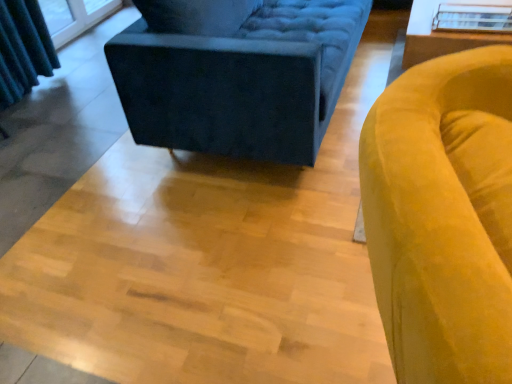
Question: Considering the relative positions of velvet yellow armchair at right and velvet dark blue studio couch at upper center in the image provided, is velvet yellow armchair at right behind velvet dark blue studio couch at upper center?

Choices:
 (A) yes
 (B) no

Answer: (B)

Question: Is velvet yellow armchair at right not inside velvet dark blue studio couch at upper center?

Choices:
 (A) yes
 (B) no

Answer: (A)

Question: From a real-world perspective, is velvet yellow armchair at right below velvet dark blue studio couch at upper center?

Choices:
 (A) no
 (B) yes

Answer: (A)

Question: Is velvet yellow armchair at right oriented towards velvet dark blue studio couch at upper center?

Choices:
 (A) yes
 (B) no

Answer: (B)

Question: Is velvet yellow armchair at right taller than velvet dark blue studio couch at upper center?

Choices:
 (A) no
 (B) yes

Answer: (B)

Question: From a real-world perspective, is transparent glass table at upper right above or below velvet dark blue studio couch at upper center?

Choices:
 (A) above
 (B) below

Answer: (A)

Question: Is transparent glass table at upper right spatially inside velvet dark blue studio couch at upper center, or outside of it?

Choices:
 (A) outside
 (B) inside

Answer: (A)

Question: In the image, is transparent glass table at upper right positioned in front of or behind velvet dark blue studio couch at upper center?

Choices:
 (A) front
 (B) behind

Answer: (B)

Question: In terms of height, does transparent glass table at upper right look taller or shorter compared to velvet dark blue studio couch at upper center?

Choices:
 (A) short
 (B) tall

Answer: (A)

Question: Is velvet yellow armchair at right wider or thinner than transparent glass table at upper right?

Choices:
 (A) wide
 (B) thin

Answer: (A)

Question: Is velvet yellow armchair at right inside or outside of transparent glass table at upper right?

Choices:
 (A) outside
 (B) inside

Answer: (A)

Question: Looking at the image, does velvet yellow armchair at right seem bigger or smaller compared to transparent glass table at upper right?

Choices:
 (A) big
 (B) small

Answer: (A)

Question: Is point (442, 59) closer or farther from the camera than point (499, 6)?

Choices:
 (A) farther
 (B) closer

Answer: (B)

Question: Is white glossy table at upper right bigger or smaller than transparent glass table at upper right?

Choices:
 (A) big
 (B) small

Answer: (A)

Question: Is white glossy table at upper right taller or shorter than transparent glass table at upper right?

Choices:
 (A) tall
 (B) short

Answer: (A)